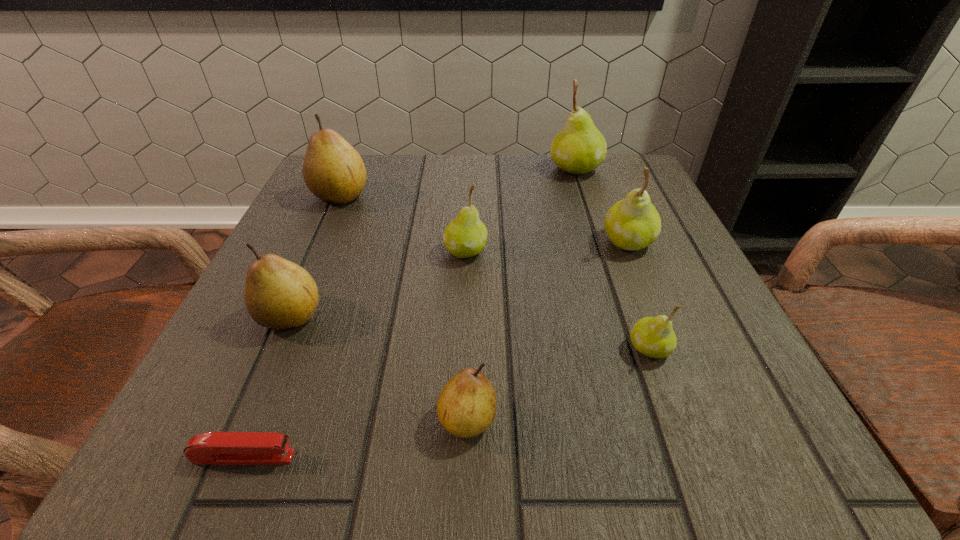
Locate an element on the screen. The width and height of the screenshot is (960, 540). the farthest green pear is located at coordinates (580, 147).

Locate an element on the screen. The height and width of the screenshot is (540, 960). the biggest green pear is located at coordinates (580, 147).

Find the location of `the farthest brown pear`. the farthest brown pear is located at coordinates (333, 170).

Find the location of `the second biggest green pear`. the second biggest green pear is located at coordinates (633, 223).

At what (x,y) coordinates should I click in order to perform the action: click on the second smallest brown pear. Please return your answer as a coordinate pair (x, y). This screenshot has height=540, width=960. Looking at the image, I should click on (279, 294).

In order to click on the leftmost green pear in this screenshot , I will do `click(465, 236)`.

The height and width of the screenshot is (540, 960). I want to click on the smallest green pear, so click(653, 337).

Where is `the seventh farthest object`? the seventh farthest object is located at coordinates (466, 407).

I want to click on the rightmost brown pear, so click(x=466, y=407).

This screenshot has height=540, width=960. What are the coordinates of `red stapler` in the screenshot? It's located at (218, 448).